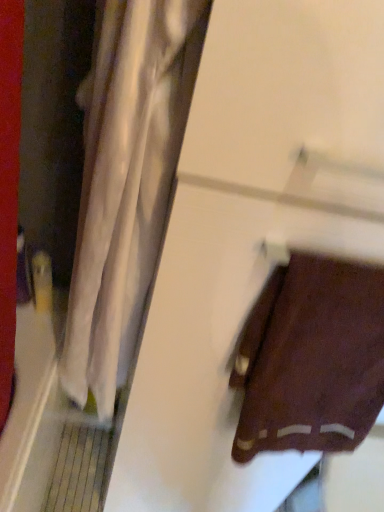
Question: Should I look upward or downward to see white sheer curtain at left?

Choices:
 (A) down
 (B) up

Answer: (A)

Question: Is the depth of brown fabric towel at lower right greater than that of white sheer curtain at left?

Choices:
 (A) no
 (B) yes

Answer: (B)

Question: Is brown fabric towel at lower right touching white sheer curtain at left?

Choices:
 (A) no
 (B) yes

Answer: (A)

Question: Considering the relative positions of brown fabric towel at lower right and white sheer curtain at left in the image provided, is brown fabric towel at lower right to the right of white sheer curtain at left from the viewer's perspective?

Choices:
 (A) no
 (B) yes

Answer: (B)

Question: From a real-world perspective, is brown fabric towel at lower right positioned over white sheer curtain at left based on gravity?

Choices:
 (A) no
 (B) yes

Answer: (A)

Question: Considering the relative positions of brown fabric towel at lower right and white sheer curtain at left in the image provided, is brown fabric towel at lower right to the left of white sheer curtain at left from the viewer's perspective?

Choices:
 (A) no
 (B) yes

Answer: (A)

Question: Considering the relative sizes of brown fabric towel at lower right and white sheer curtain at left in the image provided, is brown fabric towel at lower right smaller than white sheer curtain at left?

Choices:
 (A) yes
 (B) no

Answer: (A)

Question: Considering the relative sizes of white sheer curtain at left and brown fabric towel at lower right in the image provided, is white sheer curtain at left taller than brown fabric towel at lower right?

Choices:
 (A) yes
 (B) no

Answer: (A)

Question: Is white sheer curtain at left positioned before brown fabric towel at lower right?

Choices:
 (A) yes
 (B) no

Answer: (A)

Question: Can you confirm if white sheer curtain at left is positioned to the left of brown fabric towel at lower right?

Choices:
 (A) yes
 (B) no

Answer: (A)

Question: Can you confirm if white sheer curtain at left is wider than brown fabric towel at lower right?

Choices:
 (A) yes
 (B) no

Answer: (A)

Question: Is white sheer curtain at left turned away from brown fabric towel at lower right?

Choices:
 (A) yes
 (B) no

Answer: (B)

Question: From the image's perspective, does white sheer curtain at left appear higher than brown fabric towel at lower right?

Choices:
 (A) no
 (B) yes

Answer: (B)

Question: Is white sheer curtain at left bigger or smaller than brown fabric towel at lower right?

Choices:
 (A) big
 (B) small

Answer: (A)